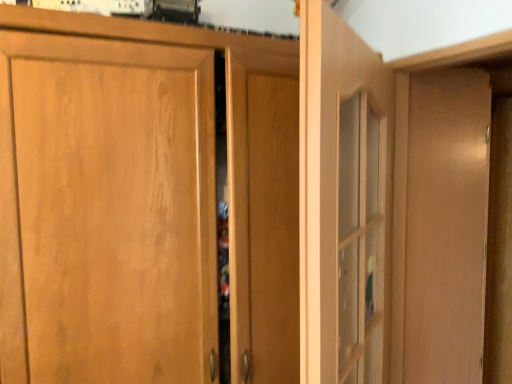
Question: From a real-world perspective, is matte wood dresser at right located beneath clear glass door at center, the second door viewed from the left?

Choices:
 (A) yes
 (B) no

Answer: (A)

Question: From the image's perspective, would you say matte wood dresser at right is shown under clear glass door at center, the second door viewed from the left?

Choices:
 (A) no
 (B) yes

Answer: (A)

Question: Would you say matte wood dresser at right contains clear glass door at center, the first door from the right?

Choices:
 (A) yes
 (B) no

Answer: (B)

Question: Is the surface of matte wood dresser at right in direct contact with clear glass door at center, the first door from the right?

Choices:
 (A) yes
 (B) no

Answer: (B)

Question: Does matte wood dresser at right have a lesser height compared to clear glass door at center, the first door from the right?

Choices:
 (A) no
 (B) yes

Answer: (A)

Question: Is matte wood dresser at right far from clear glass door at center, the second door viewed from the left?

Choices:
 (A) no
 (B) yes

Answer: (A)

Question: Would you say clear glass door at center, the second door viewed from the left, is outside wooden cabinet door at center, marked as the first door in a left-to-right arrangement?

Choices:
 (A) no
 (B) yes

Answer: (B)

Question: Considering the relative sizes of clear glass door at center, the second door viewed from the left, and wooden cabinet door at center, marked as the first door in a left-to-right arrangement, in the image provided, is clear glass door at center, the second door viewed from the left, taller than wooden cabinet door at center, marked as the first door in a left-to-right arrangement,?

Choices:
 (A) yes
 (B) no

Answer: (B)

Question: Is clear glass door at center, the first door from the right, aimed at wooden cabinet door at center, the second door viewed from the right?

Choices:
 (A) yes
 (B) no

Answer: (A)

Question: Is clear glass door at center, the first door from the right, closer to camera compared to wooden cabinet door at center, marked as the first door in a left-to-right arrangement?

Choices:
 (A) no
 (B) yes

Answer: (B)

Question: Is clear glass door at center, the second door viewed from the left, positioned behind wooden cabinet door at center, the second door viewed from the right?

Choices:
 (A) yes
 (B) no

Answer: (B)

Question: Is clear glass door at center, the second door viewed from the left, beside wooden cabinet door at center, the second door viewed from the right?

Choices:
 (A) yes
 (B) no

Answer: (B)

Question: Is wooden cabinet door at center, the second door viewed from the right, to the right of matte wood dresser at right from the viewer's perspective?

Choices:
 (A) yes
 (B) no

Answer: (B)